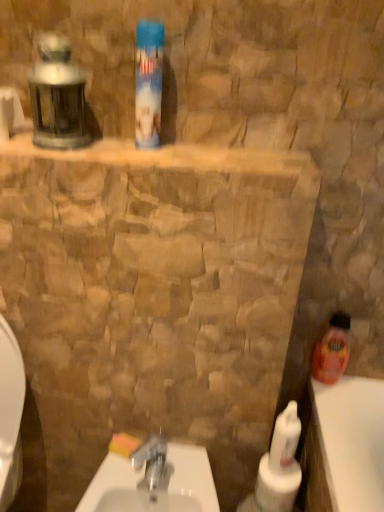
This screenshot has height=512, width=384. What do you see at coordinates (285, 439) in the screenshot? I see `white glossy bottle at lower right, the second cleaning product in the front-to-back sequence` at bounding box center [285, 439].

Identify the location of white glossy bottle at lower right, acting as the 2th cleaning product starting from the right. pyautogui.click(x=285, y=439).

The image size is (384, 512). What do you see at coordinates (148, 485) in the screenshot? I see `white glossy sink at center` at bounding box center [148, 485].

Consider the image. What is the approximate height of blue plastic can at upper center, the first cleaning product from the left?

It is 9.71 inches.

Locate an element on the screen. Image resolution: width=384 pixels, height=512 pixels. yellow sponge at lower center is located at coordinates (123, 444).

Is blue plastic can at upper center, arranged as the 3th cleaning product when viewed from the back, inside the boundaries of translucent plastic bottle at right, the first cleaning product in the right-to-left sequence, or outside?

blue plastic can at upper center, arranged as the 3th cleaning product when viewed from the back, is not enclosed by translucent plastic bottle at right, the first cleaning product in the right-to-left sequence.

At what (x,y) coordinates should I click in order to perform the action: click on cleaning product that is the 2nd one when counting backward from the blue plastic can at upper center, which ranks as the 1th cleaning product in front-to-back order. Please return your answer as a coordinate pair (x, y). Looking at the image, I should click on (332, 350).

Considering the positions of objects blue plastic can at upper center, arranged as the 3th cleaning product when viewed from the back, and translucent plastic bottle at right, which ranks as the third cleaning product in left-to-right order, in the image provided, who is behind, blue plastic can at upper center, arranged as the 3th cleaning product when viewed from the back, or translucent plastic bottle at right, which ranks as the third cleaning product in left-to-right order,?

translucent plastic bottle at right, which ranks as the third cleaning product in left-to-right order, is behind.

From a real-world perspective, is blue plastic can at upper center, which is counted as the 3th cleaning product, starting from the right, physically below translucent plastic bottle at right, the first cleaning product in the right-to-left sequence?

No, from a real-world perspective, blue plastic can at upper center, which is counted as the 3th cleaning product, starting from the right, is not under translucent plastic bottle at right, the first cleaning product in the right-to-left sequence.

Is yellow sponge at lower center further to the viewer compared to translucent plastic bottle at right, the 3th cleaning product viewed from the front?

Yes, it is.

From the image's perspective, which is below, yellow sponge at lower center or translucent plastic bottle at right, which ranks as the third cleaning product in left-to-right order?

yellow sponge at lower center is shown below in the image.

Is translucent plastic bottle at right, which ranks as the third cleaning product in left-to-right order, located within yellow sponge at lower center?

No, translucent plastic bottle at right, which ranks as the third cleaning product in left-to-right order, is not inside yellow sponge at lower center.

Is yellow sponge at lower center aimed at translucent plastic bottle at right, the 3th cleaning product viewed from the front?

No, yellow sponge at lower center is not oriented towards translucent plastic bottle at right, the 3th cleaning product viewed from the front.

Is white glossy bottle at lower right, the second cleaning product positioned from the left, taller or shorter than blue plastic can at upper center, the first cleaning product from the left?

Clearly, white glossy bottle at lower right, the second cleaning product positioned from the left, is shorter compared to blue plastic can at upper center, the first cleaning product from the left.

Is point (300, 431) less distant than point (135, 116)?

No, (300, 431) is behind (135, 116).

Looking at this image, is white glossy bottle at lower right, the second cleaning product in the front-to-back sequence, positioned before blue plastic can at upper center, the third cleaning product from the bottom?

No, it is not.

Which object is positioned more to the right, white glossy bottle at lower right, which appears as the second cleaning product when viewed from the back, or blue plastic can at upper center, the 1th cleaning product from the top?

From the viewer's perspective, white glossy bottle at lower right, which appears as the second cleaning product when viewed from the back, appears more on the right side.

Looking at their sizes, would you say yellow sponge at lower center is wider or thinner than white glossy sink at center?

yellow sponge at lower center is thinner than white glossy sink at center.

Consider the image. From the image's perspective, which object appears higher, yellow sponge at lower center or white glossy sink at center?

From the image's view, yellow sponge at lower center is above.

Between yellow sponge at lower center and white glossy sink at center, which one has smaller size?

yellow sponge at lower center.

Looking at this image, measure the distance between yellow sponge at lower center and white glossy sink at center.

yellow sponge at lower center is 3.87 inches from white glossy sink at center.

Considering the relative sizes of translucent plastic bottle at right, the 2th cleaning product positioned from the top, and white glossy sink at center in the image provided, is translucent plastic bottle at right, the 2th cleaning product positioned from the top, smaller than white glossy sink at center?

Correct, translucent plastic bottle at right, the 2th cleaning product positioned from the top, occupies less space than white glossy sink at center.

Can we say translucent plastic bottle at right, the 1th cleaning product in the back-to-front sequence, lies outside white glossy sink at center?

Yes.

Between point (347, 327) and point (131, 470), which one is positioned in front?

The point (131, 470) is in front.

From a real-world perspective, who is located higher, translucent plastic bottle at right, the first cleaning product in the right-to-left sequence, or white glossy sink at center?

translucent plastic bottle at right, the first cleaning product in the right-to-left sequence.

Does point (158, 77) come closer to viewer compared to point (283, 430)?

That is True.

Considering the sizes of objects blue plastic can at upper center, the third cleaning product from the bottom, and white glossy bottle at lower right, acting as the 2th cleaning product starting from the right, in the image provided, who is wider, blue plastic can at upper center, the third cleaning product from the bottom, or white glossy bottle at lower right, acting as the 2th cleaning product starting from the right,?

With larger width is blue plastic can at upper center, the third cleaning product from the bottom.

Which cleaning product is the 1st one when counting from the back of the blue plastic can at upper center, the third cleaning product from the bottom? Please provide its 2D coordinates.

[(285, 439)]

From a real-world perspective, is blue plastic can at upper center, which ranks as the 1th cleaning product in front-to-back order, on white glossy bottle at lower right, the second cleaning product in the front-to-back sequence?

Correct, in the physical world, blue plastic can at upper center, which ranks as the 1th cleaning product in front-to-back order, is higher than white glossy bottle at lower right, the second cleaning product in the front-to-back sequence.

Looking at this image, between blue plastic can at upper center, the 1th cleaning product from the top, and white glossy sink at center, which one has smaller size?

blue plastic can at upper center, the 1th cleaning product from the top, is smaller.

Is blue plastic can at upper center, which is counted as the 3th cleaning product, starting from the right, next to white glossy sink at center?

blue plastic can at upper center, which is counted as the 3th cleaning product, starting from the right, is not next to white glossy sink at center, and they're not touching.

How much distance is there between blue plastic can at upper center, which is counted as the 3th cleaning product, starting from the right, and white glossy sink at center?

blue plastic can at upper center, which is counted as the 3th cleaning product, starting from the right, is 32.11 inches from white glossy sink at center.

From the image's perspective, is blue plastic can at upper center, the first cleaning product from the left, located beneath white glossy sink at center?

No.

Locate an element on the screen. the 2nd cleaning product to the right of the blue plastic can at upper center, the third cleaning product from the bottom, starting your count from the anchor is located at coordinates (332, 350).

Locate an element on the screen. the 1st cleaning product in front of the yellow sponge at lower center is located at coordinates (332, 350).

Looking at the image, which one is located further to white glossy bottle at lower right, acting as the 2th cleaning product starting from the right, translucent plastic bottle at right, the 1th cleaning product in the back-to-front sequence, or blue plastic can at upper center, the first cleaning product from the left?

Based on the image, blue plastic can at upper center, the first cleaning product from the left, appears to be further to white glossy bottle at lower right, acting as the 2th cleaning product starting from the right.

Which object lies nearer to the anchor point translucent plastic bottle at right, the first cleaning product in the right-to-left sequence, white glossy sink at center or white glossy bottle at lower right, which appears as the second cleaning product when viewed from the back?

white glossy bottle at lower right, which appears as the second cleaning product when viewed from the back, is positioned closer to the anchor translucent plastic bottle at right, the first cleaning product in the right-to-left sequence.

When comparing their distances from translucent plastic bottle at right, placed as the 2th cleaning product when sorted from bottom to top, does white glossy sink at center or yellow sponge at lower center seem further?

yellow sponge at lower center is further to translucent plastic bottle at right, placed as the 2th cleaning product when sorted from bottom to top.

When comparing their distances from yellow sponge at lower center, does white glossy sink at center or translucent plastic bottle at right, the 3th cleaning product viewed from the front, seem further?

The object further to yellow sponge at lower center is translucent plastic bottle at right, the 3th cleaning product viewed from the front.

Based on their spatial positions, is white glossy bottle at lower right, the third cleaning product in the top-to-bottom sequence, or yellow sponge at lower center further from blue plastic can at upper center, the first cleaning product from the left?

Among the two, yellow sponge at lower center is located further to blue plastic can at upper center, the first cleaning product from the left.

Which object lies nearer to the anchor point white glossy bottle at lower right, which appears as the second cleaning product when viewed from the back, translucent plastic bottle at right, the 2th cleaning product positioned from the top, or yellow sponge at lower center?

Based on the image, translucent plastic bottle at right, the 2th cleaning product positioned from the top, appears to be nearer to white glossy bottle at lower right, which appears as the second cleaning product when viewed from the back.

Considering their positions, is white glossy sink at center positioned closer to white glossy bottle at lower right, the second cleaning product positioned from the left, than blue plastic can at upper center, the first cleaning product from the left?

Among the two, white glossy sink at center is located nearer to white glossy bottle at lower right, the second cleaning product positioned from the left.

Based on their spatial positions, is white glossy bottle at lower right, acting as the 2th cleaning product starting from the right, or blue plastic can at upper center, which is counted as the 3th cleaning product, starting from the right, further from translucent plastic bottle at right, the 3th cleaning product viewed from the front?

Based on the image, blue plastic can at upper center, which is counted as the 3th cleaning product, starting from the right, appears to be further to translucent plastic bottle at right, the 3th cleaning product viewed from the front.

Locate an element on the screen. This screenshot has height=512, width=384. cleaning product between blue plastic can at upper center, the third cleaning product from the bottom, and white glossy bottle at lower right, which is the 1th cleaning product in bottom-to-top order, in the vertical direction is located at coordinates (332, 350).

Where is `soap between blue plastic can at upper center, arranged as the 3th cleaning product when viewed from the back, and white glossy sink at center in the up-down direction`? soap between blue plastic can at upper center, arranged as the 3th cleaning product when viewed from the back, and white glossy sink at center in the up-down direction is located at coordinates (123, 444).

I want to click on sink between yellow sponge at lower center and white glossy bottle at lower right, which appears as the second cleaning product when viewed from the back, from left to right, so click(148, 485).

At what (x,y) coordinates should I click in order to perform the action: click on sink between yellow sponge at lower center and translucent plastic bottle at right, the first cleaning product in the right-to-left sequence, from left to right. Please return your answer as a coordinate pair (x, y). Image resolution: width=384 pixels, height=512 pixels. Looking at the image, I should click on (148, 485).